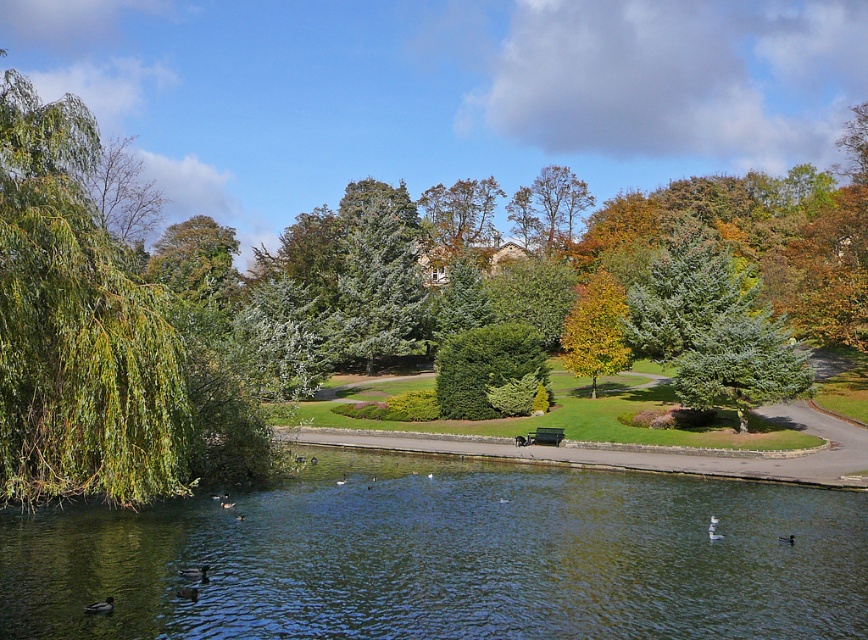
You are standing in the park and want to take a photo of both the green leafy tree at left and the dark gray matte duck at lower right. Based on their positions, which object should you focus on first to ensure both are in clear view?

The green leafy tree at left is closer to the viewer than the dark gray matte duck at lower right, so you should focus on the green leafy tree at left first to ensure both are in clear view.